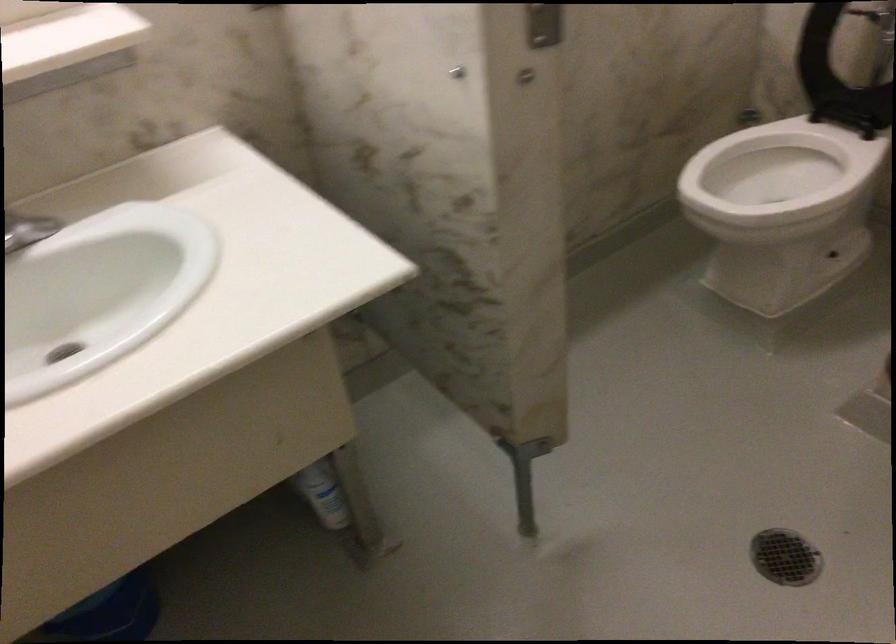
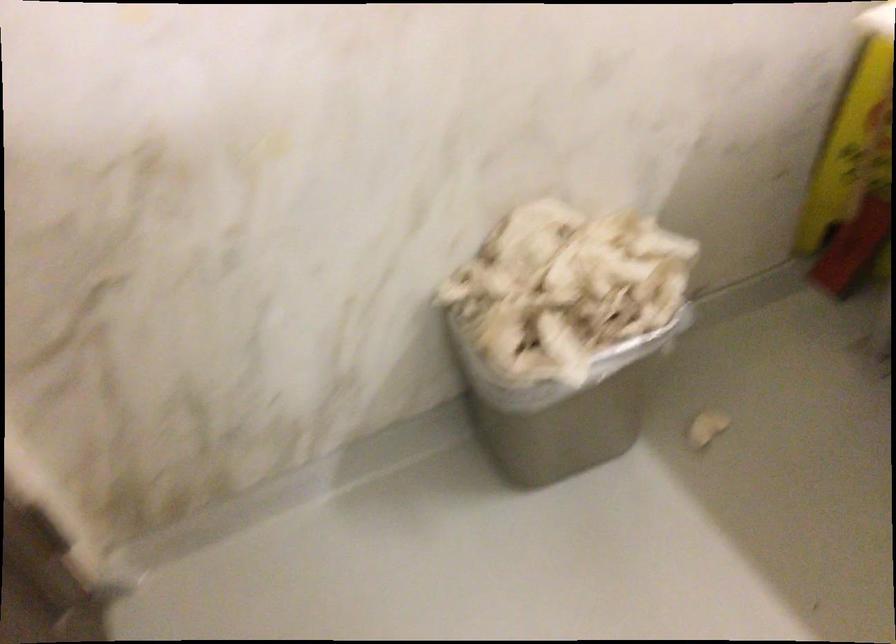
Based on the continuous images, in which direction is the camera rotating?

The camera's rotation is toward left-down.